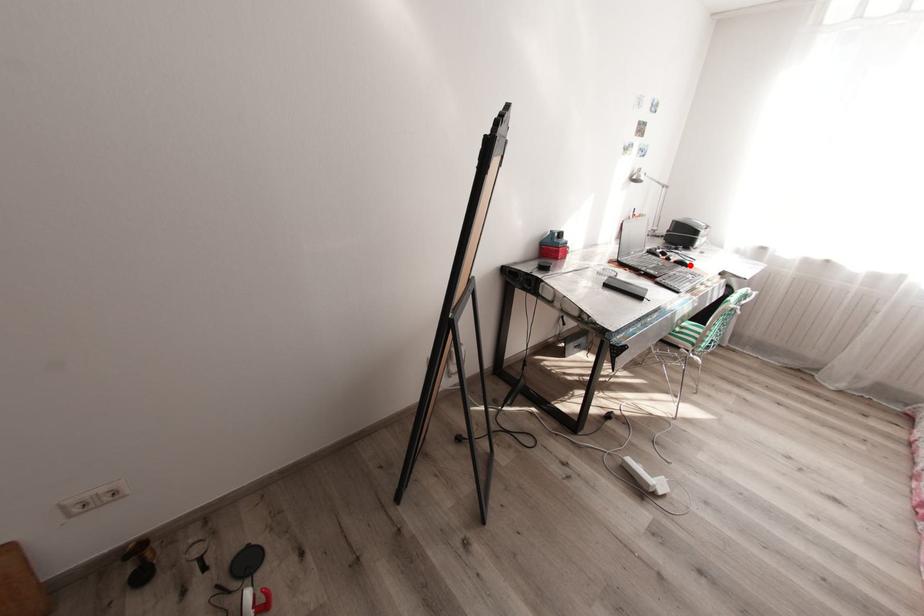
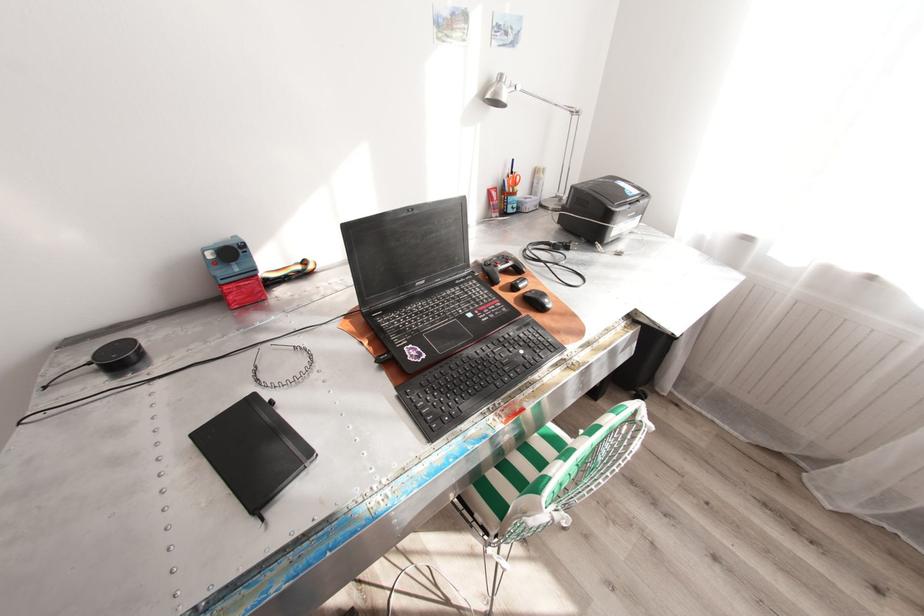
The point at the highlighted location is marked in the first image. Where is the corresponding point in the second image?

(545, 308)